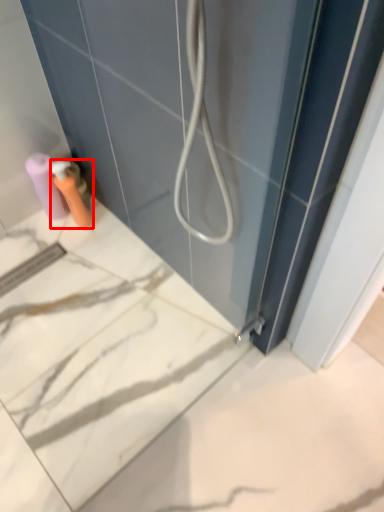
Question: From the image's perspective, considering the relative positions of toiletry (annotated by the red box) and toilet paper in the image provided, where is toiletry (annotated by the red box) located with respect to the staircase?

Choices:
 (A) above
 (B) below

Answer: (B)